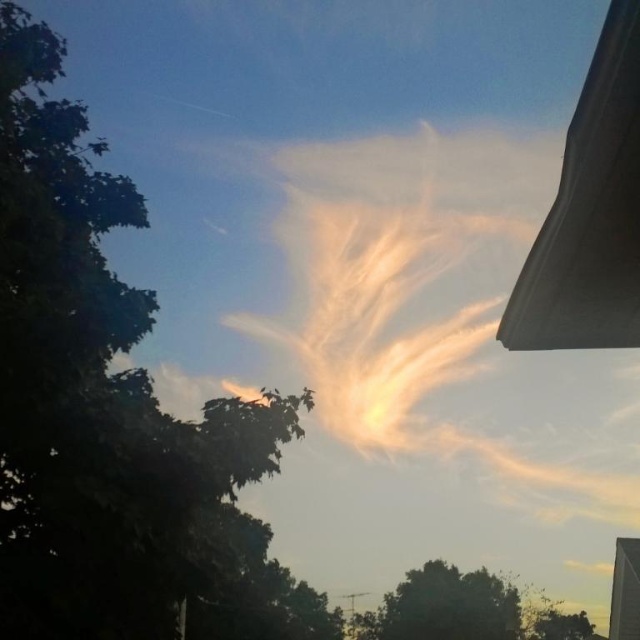
You are an observer standing in the middle of the scene. You notice the green leafy tree at left and the translucent cotton cloud at center. Which object appears taller from your vantage point?

The translucent cotton cloud at center appears taller than the green leafy tree at left from your vantage point because the green leafy tree at left is shorter than the translucent cotton cloud at center.

In the scene shown: You are standing in the scene looking at the vibrant sky with the cloud shaped like a bird. There is a specific point marked at coordinates point [316,317]. If you want to place a small flag exactly at that point, how far in meters should you walk from your current position to reach it?

The point [316,317] is 45.77 meters away from the viewer, so you should walk 45.77 meters to reach it.